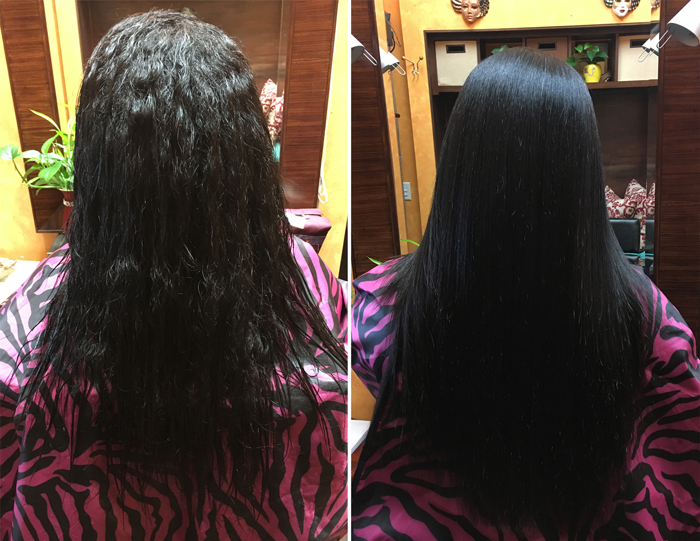
Locate an element on the screen. decorative mask is located at coordinates (620, 8), (477, 12).